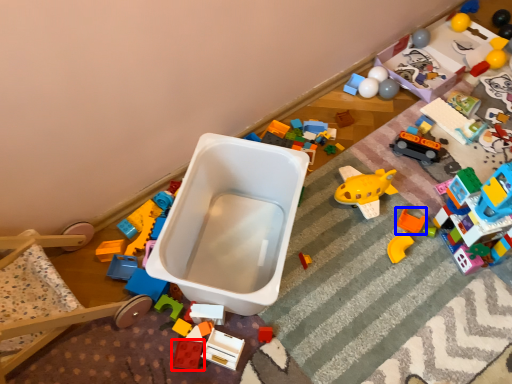
Question: Which object is further to the camera taking this photo, toy (highlighted by a red box) or toy (highlighted by a blue box)?

Choices:
 (A) toy
 (B) toy

Answer: (B)